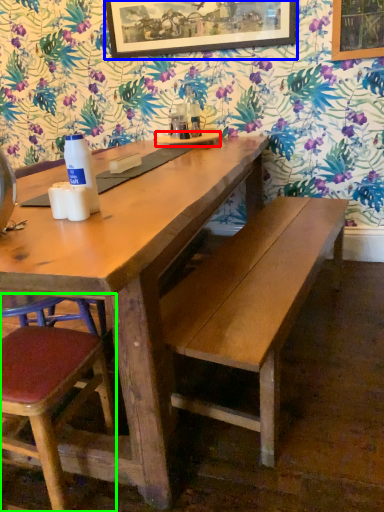
Question: Which object is the farthest from plate (highlighted by a red box)? Choose among these: picture frame (highlighted by a blue box) or chair (highlighted by a green box).

Choices:
 (A) picture frame
 (B) chair

Answer: (B)